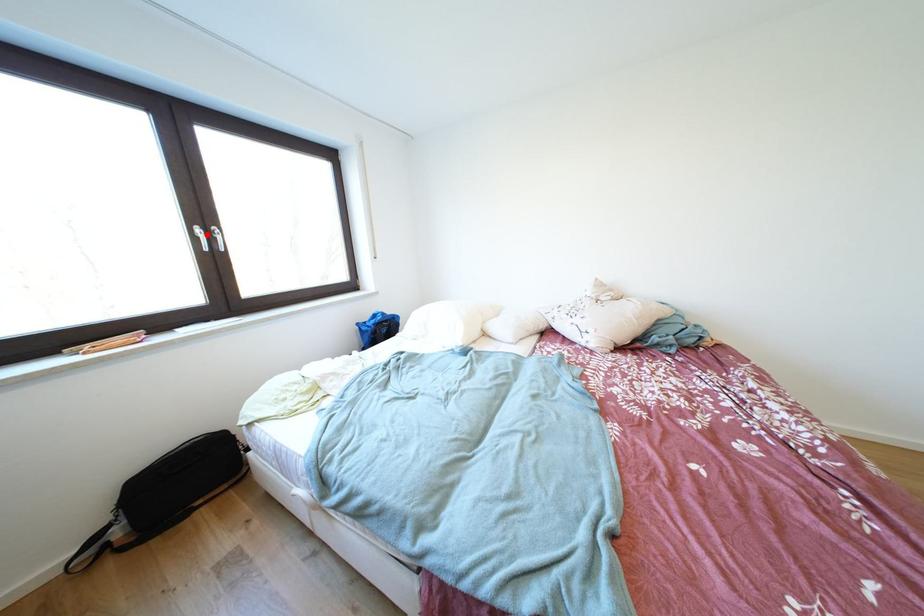
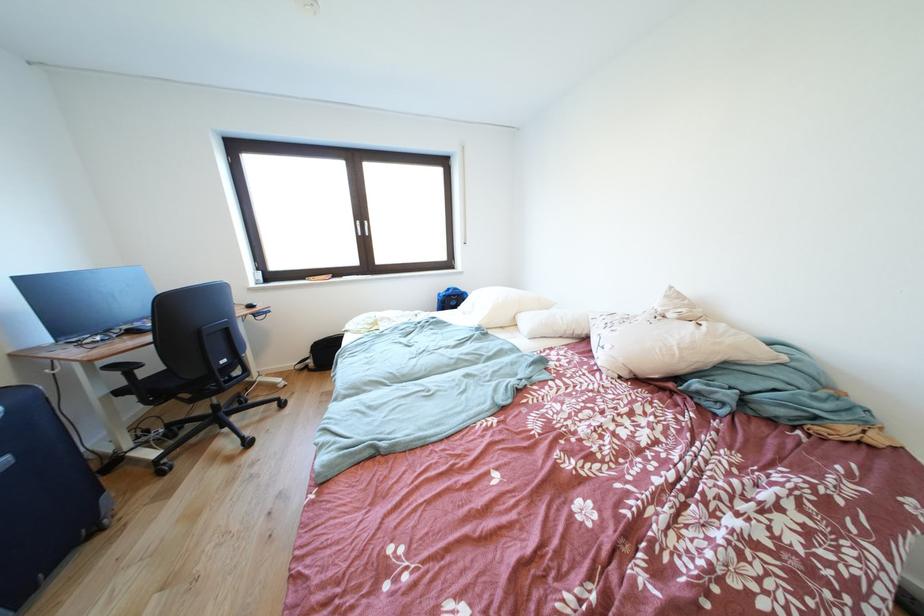
Find the pixel in the second image that matches the highlighted location in the first image.

(367, 228)